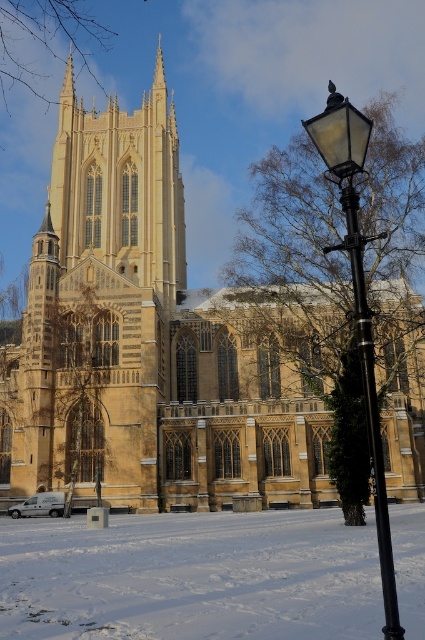
Is point (345, 545) farther from viewer compared to point (380, 488)?

Yes, it is.

Does white powdery snow at lower left have a lesser width compared to black polished metal streetlight at right?

No, white powdery snow at lower left is not thinner than black polished metal streetlight at right.

Does point (289, 554) come farther from viewer compared to point (365, 125)?

Yes.

I want to click on white powdery snow at lower left, so click(x=190, y=577).

Can you confirm if golden stone tower at upper center is positioned above black polished metal streetlight at right?

Correct, golden stone tower at upper center is located above black polished metal streetlight at right.

Is golden stone tower at upper center shorter than black polished metal streetlight at right?

Yes, golden stone tower at upper center is shorter than black polished metal streetlight at right.

Who is more forward, (82, 113) or (384, 628)?

Point (384, 628) is in front.

In order to click on golden stone tower at upper center in this screenshot , I will do `click(121, 188)`.

This screenshot has width=425, height=640. Identify the location of white powdery snow at lower left. (190, 577).

Does white powdery snow at lower left have a lesser height compared to golden stone tower at upper center?

Yes.

I want to click on white powdery snow at lower left, so click(190, 577).